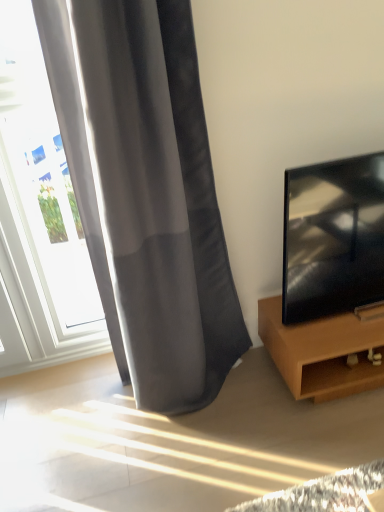
Locate an element on the screen. The image size is (384, 512). free space above brown wood tv stand at right (from a real-world perspective) is located at coordinates (344, 320).